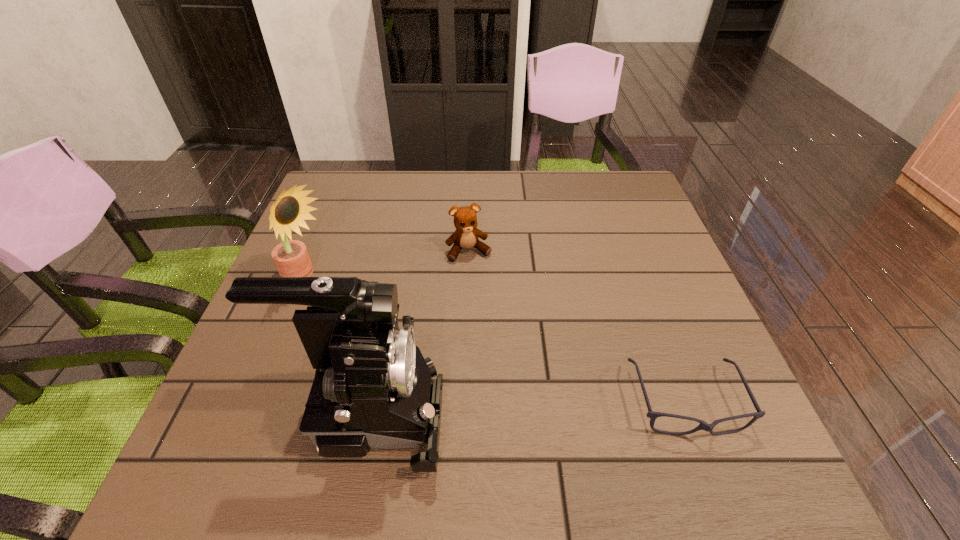
Identify the location of blank region between the second shortest object and the shortest object. Image resolution: width=960 pixels, height=540 pixels. (577, 327).

Where is `unoccupied area between the shortest object and the third shortest object`? unoccupied area between the shortest object and the third shortest object is located at coordinates (495, 341).

Find the location of `empty space between the third shortest object and the teddy bear`. empty space between the third shortest object and the teddy bear is located at coordinates coord(387,266).

Where is `free area in between the spectacles and the teddy bear`? free area in between the spectacles and the teddy bear is located at coordinates (577, 327).

Where is `vacant area that lies between the leftmost object and the rightmost object`? This screenshot has height=540, width=960. vacant area that lies between the leftmost object and the rightmost object is located at coordinates (495, 341).

The height and width of the screenshot is (540, 960). Identify the location of vacant region between the second tallest object and the teddy bear. (387, 266).

Select which object is the second closest to the leftmost object. Please provide its 2D coordinates. Your answer should be formatted as a tuple, i.e. [(x, y)], where the tuple contains the x and y coordinates of a point satisfying the conditions above.

[(466, 235)]

Identify which object is located as the nearest to the camcorder. Please provide its 2D coordinates. Your answer should be formatted as a tuple, i.e. [(x, y)], where the tuple contains the x and y coordinates of a point satisfying the conditions above.

[(291, 257)]

What are the coordinates of `vacant region that satisfies the following two spatial constraints: 1. on the back side of the second tallest object; 2. on the right side of the third tallest object` in the screenshot? It's located at (318, 251).

Locate an element on the screen. This screenshot has height=540, width=960. blank area in the image that satisfies the following two spatial constraints: 1. on the front side of the second tallest object; 2. on the lens mount of the tallest object is located at coordinates (252, 414).